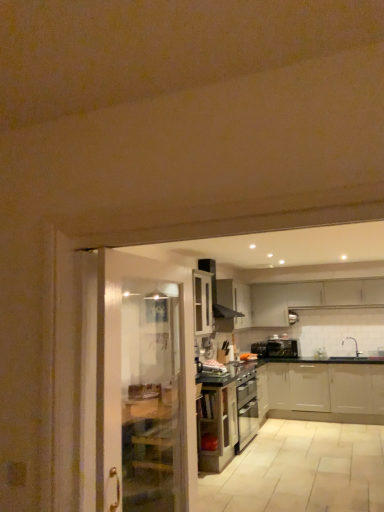
Question: Should I look upward or downward to see wooden cabinet at center?

Choices:
 (A) up
 (B) down

Answer: (B)